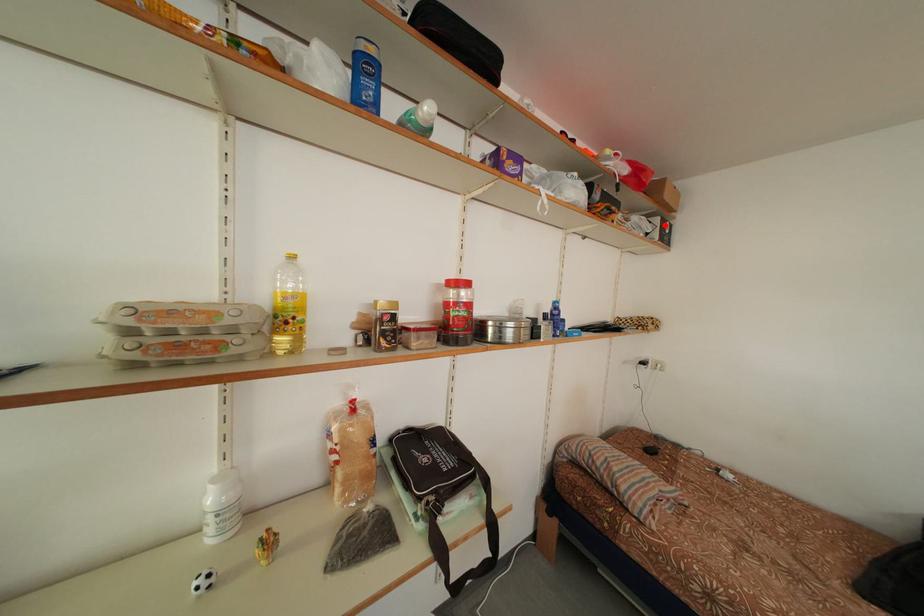
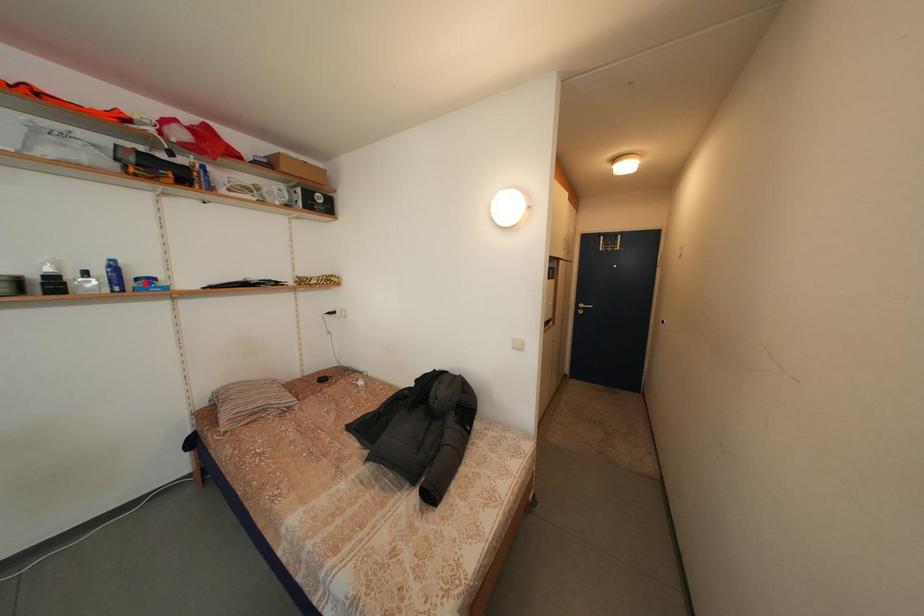
I am providing you with two images of the same scene from different viewpoints. A red point is marked on the first image and another point is marked on the second image. Do the highlighted points in image1 and image2 indicate the same real-world spot?

No